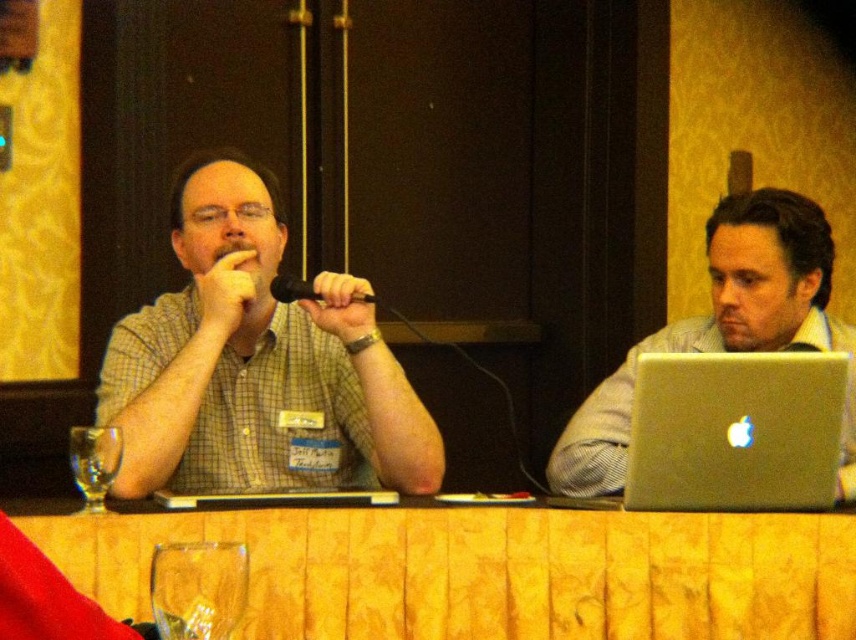
You are standing at the camera position and want to place a small table exactly at point (372, 326). The table has a height of 0.7 meters. The ceiling height in the room is 2.5 meters. Will the table fit under the ceiling without touching it?

The distance between the camera and point (372, 326) is 1.90 meters. The table height is 0.7 meters, and the ceiling is 2.5 meters high. Since the table is placed on the floor, its height does not affect the vertical clearance. The vertical distance from the table to the ceiling is 2.5 meters, which is more than enough to accommodate the table without touching the ceiling.

You are a photographer standing at the origin point of the coordinate system. The silver metallic laptop at right is represented by point (724, 330). Where should you position your camera to capture the silver metallic laptop at right in the center of the photo?

To center the silver metallic laptop at point (724, 330) in the photo, position your camera at the same coordinates, (724, 330).

Looking at this image, you are organizing a small workshop and need to place a 12x12 inch square poster on the yellow fabric table at center. Considering the size of the silver metallic laptop at right, will the poster fit on the table without overlapping the laptop?

The yellow fabric table at center has a smaller size compared to the silver metallic laptop at right, so the poster may not fit without overlapping the laptop since the table is smaller than the laptop.